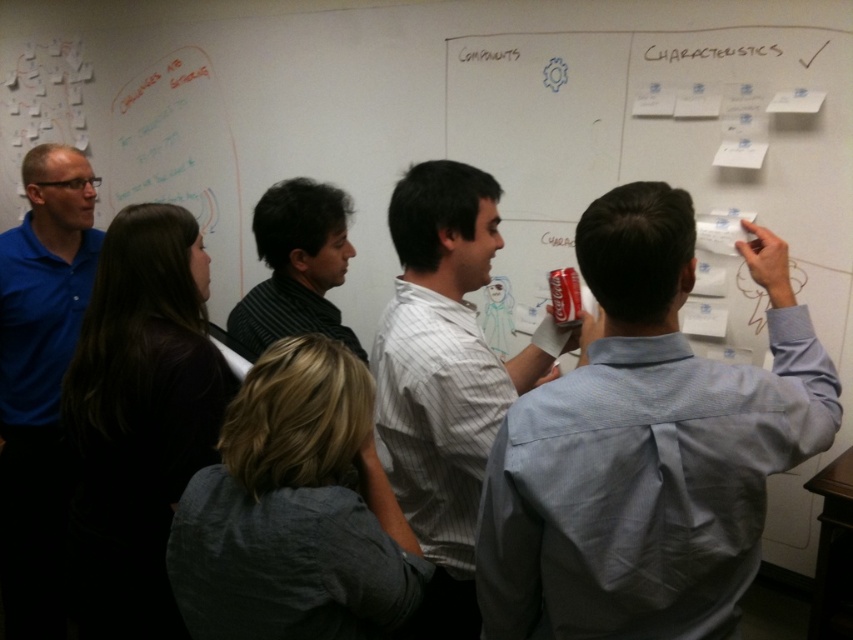
Question: Which object is closer to the camera taking this photo?

Choices:
 (A) white paper at upper right
 (B) blue cotton polo shirt at left
 (C) black shirt at left
 (D) light blue shirt at center

Answer: (D)

Question: Can you confirm if gray cotton shirt at center is positioned below black shirt at left?

Choices:
 (A) no
 (B) yes

Answer: (B)

Question: Can you confirm if light blue shirt at center is positioned to the right of striped shirt at center?

Choices:
 (A) no
 (B) yes

Answer: (B)

Question: Among these objects, which one is farthest from the camera?

Choices:
 (A) white paper at upper right
 (B) gray cotton shirt at center

Answer: (A)

Question: Is light blue shirt at center smaller than blue cotton polo shirt at left?

Choices:
 (A) no
 (B) yes

Answer: (A)

Question: Which point is farther from the camera taking this photo?

Choices:
 (A) (450, 275)
 (B) (685, 56)

Answer: (B)